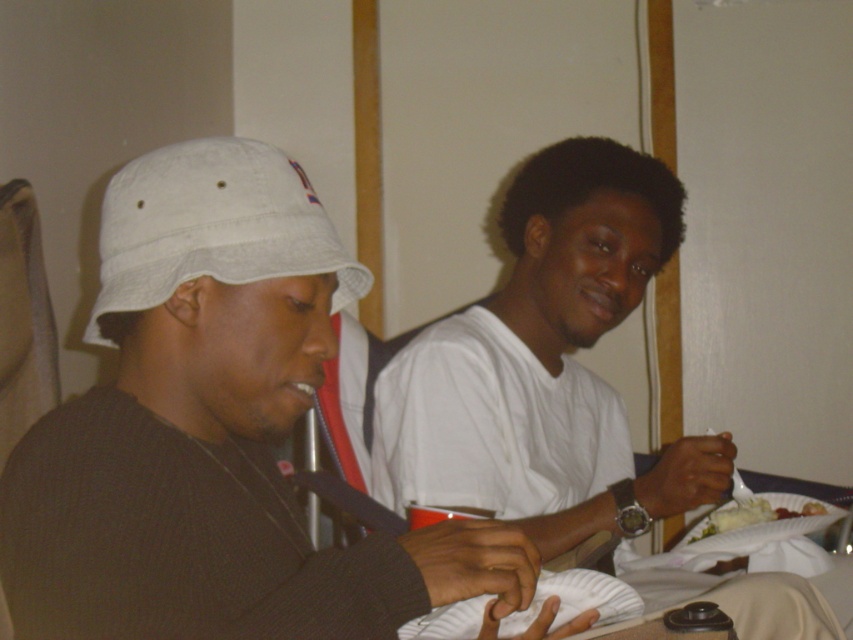
You are standing 5 feet away from the table in the image. There is a point at coordinates point (625, 440). Can you reach that point without moving closer to the table?

The distance of point (625, 440) from viewer is 6.32 feet. Since you are currently 5 feet away from the table, you are 1.32 feet away from the point. Therefore, you can reach the point without moving closer.

You are sitting at the table in the image and want to place a napkin between the two points labeled point (283, 211) and point (517, 179). Based on their positions, which point should the napkin be closer to?

The napkin should be placed closer to point (517, 179) because point (283, 211) is in front of it, meaning the napkin needs to be positioned between them with the closer point being the one further back.

You are a photographer taking a photo of two people sitting at a table. You notice the white matte bucket hat at left and the white fabric baseball hat at left. Which hat should you focus on if you want to capture the wider one in your shot?

The white matte bucket hat at left is wider than the white fabric baseball hat at left, so focusing on the white matte bucket hat at left will capture the wider one.